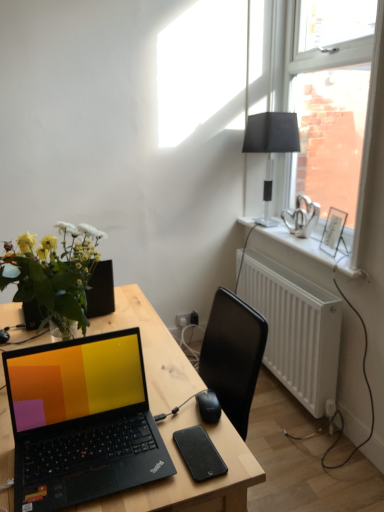
Locate an element on the screen. The width and height of the screenshot is (384, 512). vacant space positioned to the left of black plastic mouse at center is located at coordinates tap(161, 413).